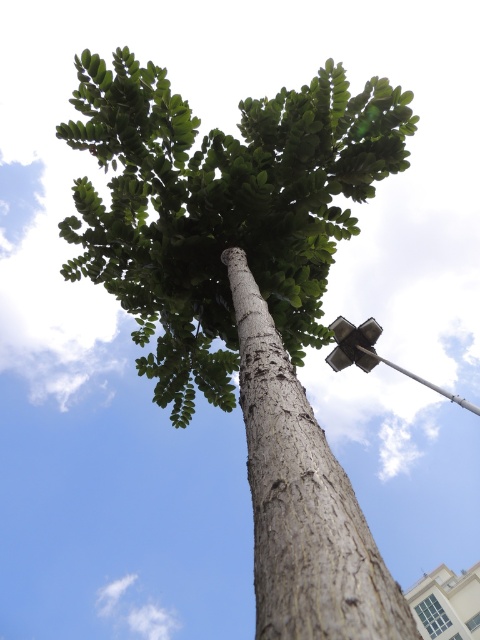
Can you confirm if green rough bark tree at center is shorter than metallic silver streetlight at upper right?

No, green rough bark tree at center is not shorter than metallic silver streetlight at upper right.

Consider the image. Is green rough bark tree at center above metallic silver streetlight at upper right?

Correct, green rough bark tree at center is located above metallic silver streetlight at upper right.

Locate an element on the screen. green rough bark tree at center is located at coordinates (247, 300).

Can you confirm if gray textured tree trunk at center is positioned to the left of metallic silver streetlight at upper right?

Correct, you'll find gray textured tree trunk at center to the left of metallic silver streetlight at upper right.

Who is taller, gray textured tree trunk at center or metallic silver streetlight at upper right?

metallic silver streetlight at upper right

Is point (326, 563) farther from viewer compared to point (431, 387)?

No, it is not.

This screenshot has width=480, height=640. Identify the location of gray textured tree trunk at center. [x=302, y=500].

Which is in front, point (299, 385) or point (337, 531)?

Point (337, 531)

Is green rough bark tree at center to the right of gray textured tree trunk at center from the viewer's perspective?

In fact, green rough bark tree at center is to the left of gray textured tree trunk at center.

Describe the element at coordinates (247, 300) in the screenshot. Image resolution: width=480 pixels, height=640 pixels. I see `green rough bark tree at center` at that location.

The width and height of the screenshot is (480, 640). In order to click on green rough bark tree at center in this screenshot , I will do `click(247, 300)`.